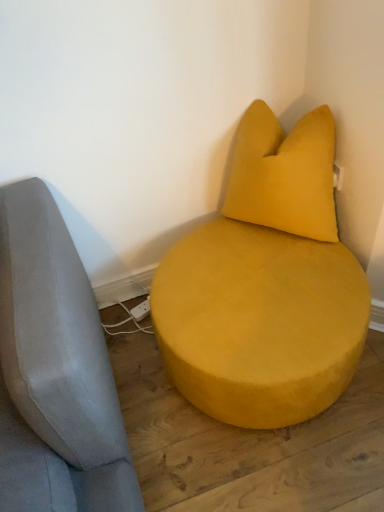
Question: Is velvet yellow pillow at upper right further to camera compared to suede yellow ottoman at center?

Choices:
 (A) no
 (B) yes

Answer: (B)

Question: Considering the relative sizes of velvet yellow pillow at upper right and suede yellow ottoman at center in the image provided, is velvet yellow pillow at upper right bigger than suede yellow ottoman at center?

Choices:
 (A) no
 (B) yes

Answer: (A)

Question: Can you confirm if velvet yellow pillow at upper right is smaller than suede yellow ottoman at center?

Choices:
 (A) no
 (B) yes

Answer: (B)

Question: Is velvet yellow pillow at upper right oriented towards suede yellow ottoman at center?

Choices:
 (A) yes
 (B) no

Answer: (B)

Question: From the image's perspective, is velvet yellow pillow at upper right on suede yellow ottoman at center?

Choices:
 (A) yes
 (B) no

Answer: (A)

Question: Can you confirm if velvet yellow pillow at upper right is wider than suede yellow ottoman at center?

Choices:
 (A) yes
 (B) no

Answer: (B)

Question: Is suede yellow ottoman at center wider than velvet yellow pillow at upper right?

Choices:
 (A) no
 (B) yes

Answer: (B)

Question: Considering the relative sizes of suede yellow ottoman at center and velvet yellow pillow at upper right in the image provided, is suede yellow ottoman at center taller than velvet yellow pillow at upper right?

Choices:
 (A) no
 (B) yes

Answer: (A)

Question: Would you consider suede yellow ottoman at center to be distant from velvet yellow pillow at upper right?

Choices:
 (A) no
 (B) yes

Answer: (A)

Question: Considering the relative positions of suede yellow ottoman at center and velvet yellow pillow at upper right in the image provided, is suede yellow ottoman at center in front of velvet yellow pillow at upper right?

Choices:
 (A) yes
 (B) no

Answer: (A)

Question: Can you confirm if suede yellow ottoman at center is thinner than velvet yellow pillow at upper right?

Choices:
 (A) no
 (B) yes

Answer: (A)

Question: Is suede yellow ottoman at center positioned beyond the bounds of velvet yellow pillow at upper right?

Choices:
 (A) no
 (B) yes

Answer: (B)

Question: In terms of height, does velvet yellow pillow at upper right look taller or shorter compared to suede yellow ottoman at center?

Choices:
 (A) tall
 (B) short

Answer: (A)